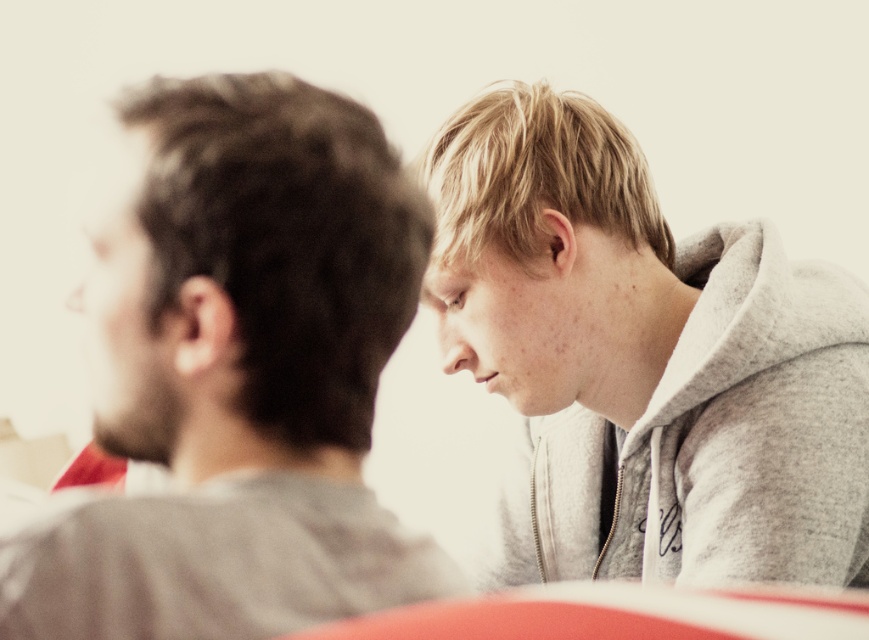
Can you confirm if gray matte shirt at left is bigger than gray fleece hoodie at upper right?

No.

Is gray matte shirt at left below gray fleece hoodie at upper right?

No.

Who is more distant from viewer, (x=169, y=84) or (x=664, y=449)?

The point (x=664, y=449) is more distant.

Locate an element on the screen. This screenshot has width=869, height=640. gray matte shirt at left is located at coordinates (240, 378).